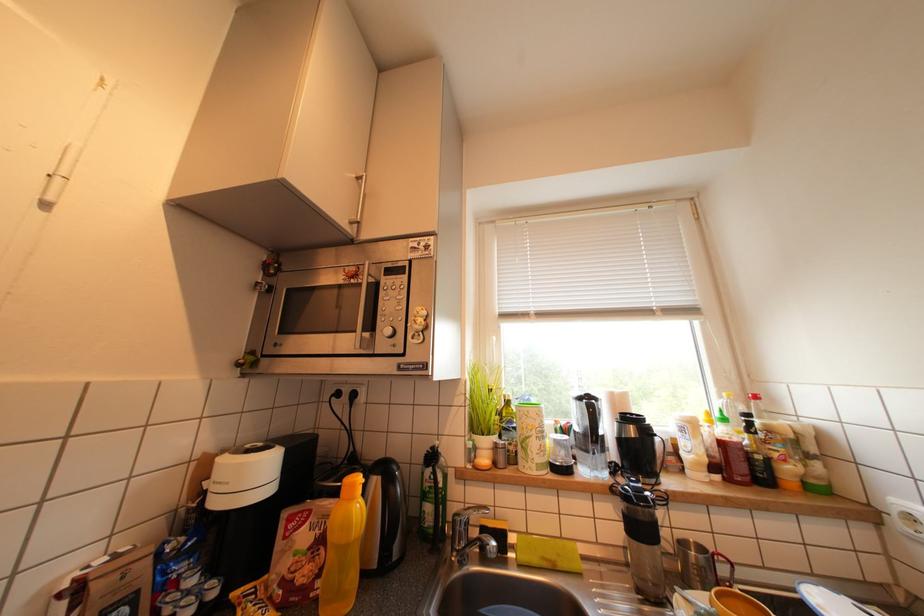
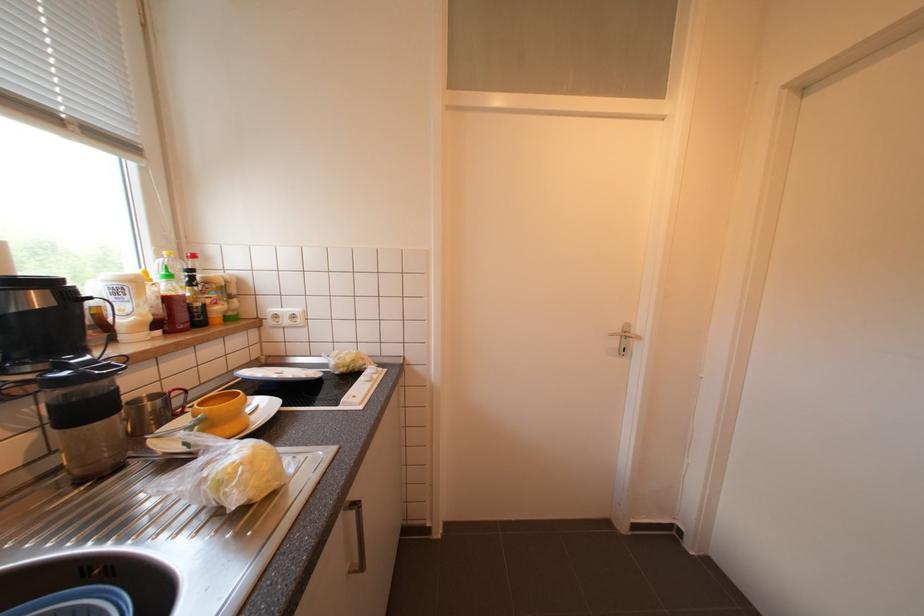
Question: The images are taken continuously from a first-person perspective. In which direction is your viewpoint rotating?

Choices:
 (A) Left
 (B) Right
 (C) Up
 (D) Down

Answer: (B)